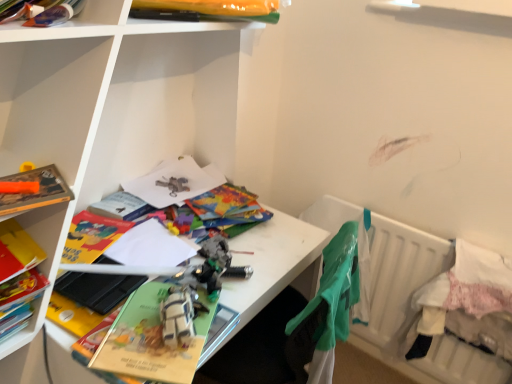
Where is `free point above white plastic bed at lower right, which is the 1th bed in back-to-front order (from a real-world perspective)`? Image resolution: width=512 pixels, height=384 pixels. free point above white plastic bed at lower right, which is the 1th bed in back-to-front order (from a real-world perspective) is located at coordinates (437, 228).